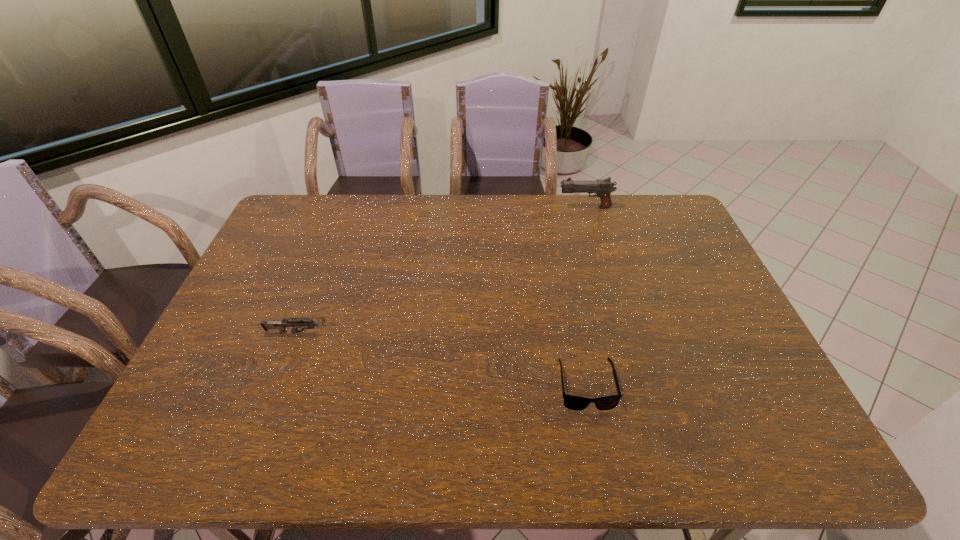
The image size is (960, 540). Identify the location of vacant point that satisfies the following two spatial constraints: 1. in the direction the farthest object is aimed; 2. on the front-facing side of the nearest object. (636, 384).

I want to click on free point that satisfies the following two spatial constraints: 1. in the direction the taller gun is aimed; 2. on the front-facing side of the nearest object, so click(x=636, y=384).